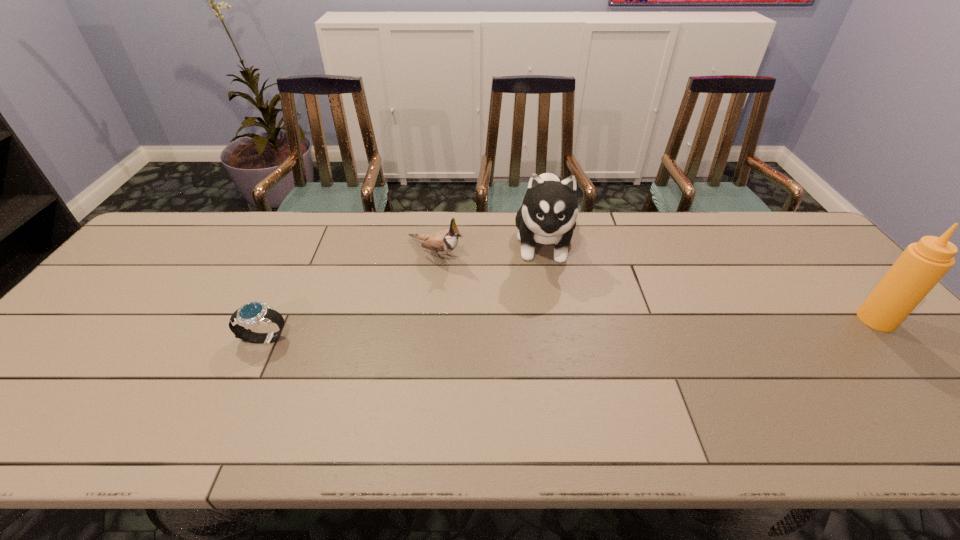
The width and height of the screenshot is (960, 540). In order to click on free spot between the watch and the condiment in this screenshot , I will do `click(570, 329)`.

You are a GUI agent. You are given a task and a screenshot of the screen. Output one action in this format:
    pyautogui.click(x=<x>, y=<y>)
    Task: Click on the unoccupied position between the second object from left to right and the second object from right to left
    This screenshot has width=960, height=540.
    Given the screenshot: What is the action you would take?
    pyautogui.click(x=490, y=248)

At what (x,y) coordinates should I click in order to perform the action: click on object that ranks as the second closest to the rightmost object. Please return your answer as a coordinate pair (x, y). Looking at the image, I should click on [x=444, y=241].

Select which object is the second closest to the leftmost object. Please provide its 2D coordinates. Your answer should be formatted as a tuple, i.e. [(x, y)], where the tuple contains the x and y coordinates of a point satisfying the conditions above.

[(548, 214)]

Find the location of `free region that satisfies the following two spatial constraints: 1. on the front side of the puppy; 2. on the left side of the rightmost object`. free region that satisfies the following two spatial constraints: 1. on the front side of the puppy; 2. on the left side of the rightmost object is located at coordinates (559, 319).

What are the coordinates of `free region that satisfies the following two spatial constraints: 1. on the back side of the puppy; 2. on the right side of the second object from left to right` in the screenshot? It's located at (437, 243).

Where is `blank space that satisfies the following two spatial constraints: 1. on the back side of the puppy; 2. on the left side of the leftmost object`? The image size is (960, 540). blank space that satisfies the following two spatial constraints: 1. on the back side of the puppy; 2. on the left side of the leftmost object is located at coordinates (309, 243).